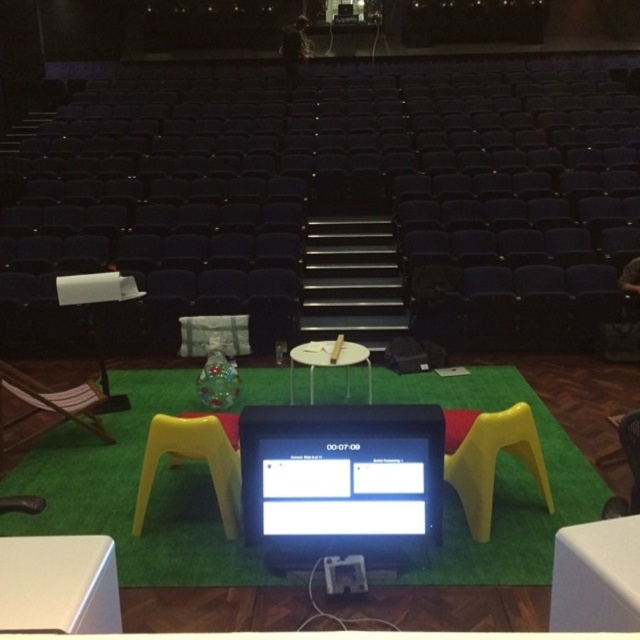
Question: Which object is positioned closest to the white plastic table at lower left?

Choices:
 (A) wooden chair at lower right
 (B) matte black monitor at center
 (C) green artificial turf at center
 (D) yellow plastic stool at lower center

Answer: (B)

Question: Can you confirm if matte black monitor at center is positioned to the right of wooden chair at lower right?

Choices:
 (A) yes
 (B) no

Answer: (B)

Question: Is green artificial turf at center positioned behind matte black monitor at center?

Choices:
 (A) yes
 (B) no

Answer: (A)

Question: Which point is farther to the camera?

Choices:
 (A) white glossy table at center
 (B) matte black monitor at center

Answer: (A)

Question: Estimate the real-world distances between objects in this image. Which object is closer to the matte black monitor at center?

Choices:
 (A) green artificial turf at center
 (B) white plastic table at lower right

Answer: (A)

Question: From the image, what is the correct spatial relationship of matte black monitor at center in relation to wooden chair at lower right?

Choices:
 (A) above
 (B) below

Answer: (B)